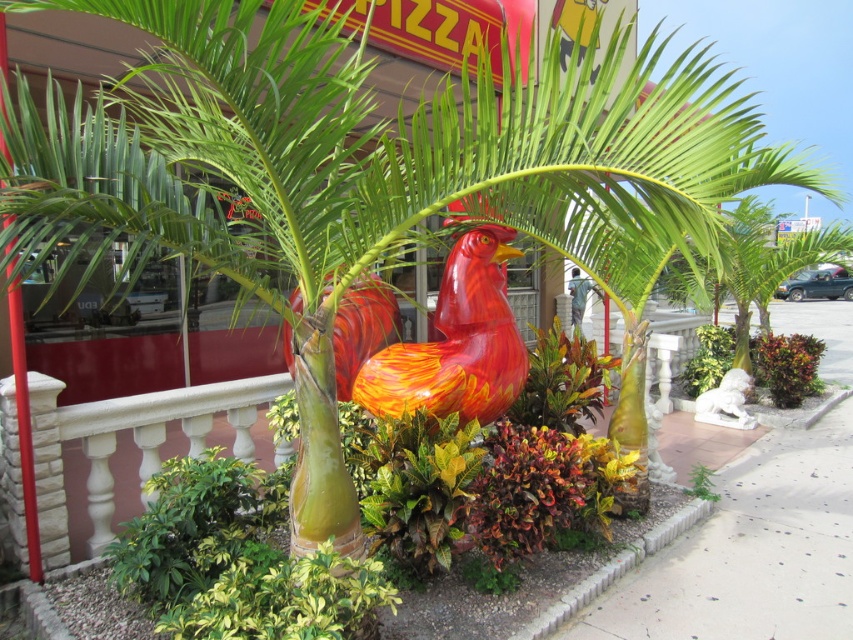
Question: Considering the real-world distances, which object is closest to the shiny orange bird at center?

Choices:
 (A) brick at lower right
 (B) shiny red and orange rooster at center

Answer: (B)

Question: Where is shiny red and orange rooster at center located in relation to brick at lower right in the image?

Choices:
 (A) below
 (B) above

Answer: (B)

Question: Does shiny orange bird at center have a lesser width compared to brick at lower right?

Choices:
 (A) no
 (B) yes

Answer: (B)

Question: From the image, what is the correct spatial relationship of shiny red and orange rooster at center in relation to brick at lower right?

Choices:
 (A) above
 (B) below

Answer: (A)

Question: Which of these objects is positioned farthest from the shiny orange bird at center?

Choices:
 (A) brick at lower right
 (B) shiny red and orange rooster at center

Answer: (A)

Question: Which point is closer to the camera?

Choices:
 (A) shiny red and orange rooster at center
 (B) brick at lower right

Answer: (B)